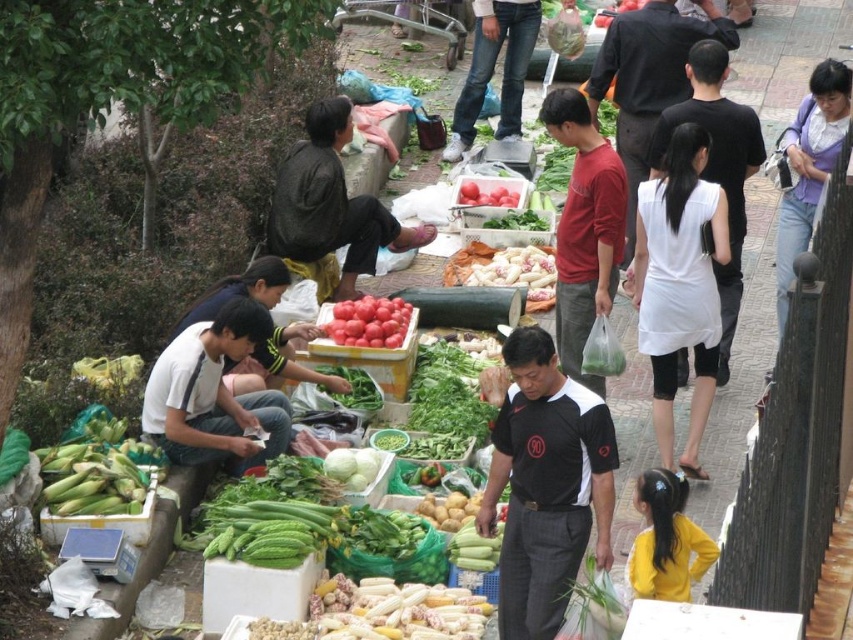
Question: Based on their relative distances, which object is farther from the matte red shirt at center?

Choices:
 (A) white cotton dress at center
 (B) black jersey at center

Answer: (B)

Question: From the image, what is the correct spatial relationship of white cotton dress at center in relation to yellow matte shirt at lower right?

Choices:
 (A) left
 (B) right

Answer: (B)

Question: Does white cotton dress at center appear under yellow matte shirt at lower right?

Choices:
 (A) yes
 (B) no

Answer: (B)

Question: Can you confirm if black jersey at center is positioned above matte red shirt at center?

Choices:
 (A) yes
 (B) no

Answer: (B)

Question: Which point appears farthest from the camera in this image?

Choices:
 (A) pos(287,440)
 (B) pos(467,188)
 (C) pos(68,509)
 (D) pos(514,410)

Answer: (B)

Question: Among these objects, which one is nearest to the camera?

Choices:
 (A) white cotton dress at center
 (B) smooth red tomatoes at center

Answer: (A)